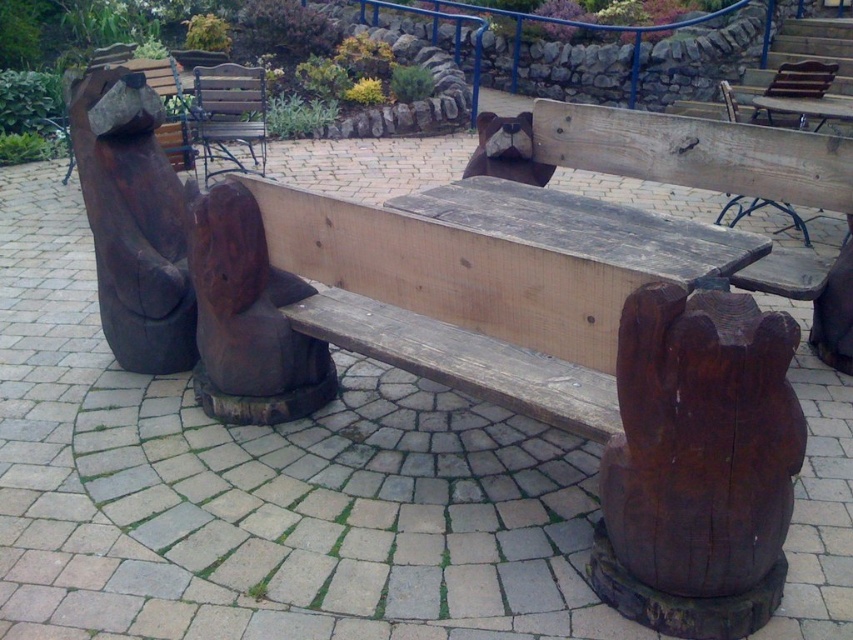
Question: Can you confirm if rustic wood bear at left is positioned below wooden slats bench at center?

Choices:
 (A) yes
 (B) no

Answer: (A)

Question: Can you confirm if rustic wood bear at left is bigger than wooden slats bench at center?

Choices:
 (A) yes
 (B) no

Answer: (B)

Question: Which point is closer to the camera taking this photo?

Choices:
 (A) (231, 156)
 (B) (107, 317)

Answer: (B)

Question: Can you confirm if rustic wood bear at left is positioned above wooden slats bench at center?

Choices:
 (A) no
 (B) yes

Answer: (A)

Question: Which point appears farthest from the camera in this image?

Choices:
 (A) (250, 292)
 (B) (244, 93)

Answer: (B)